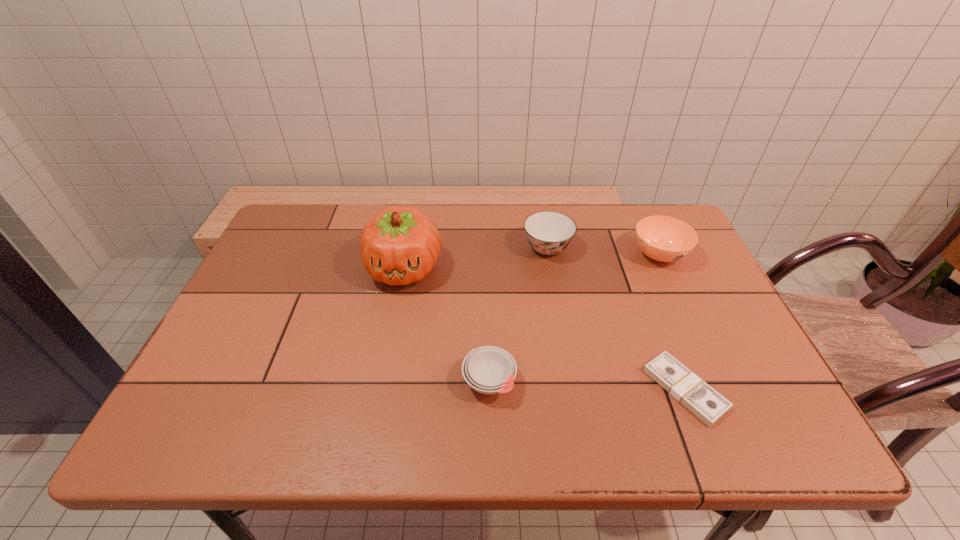
Find the location of a particular element. The height and width of the screenshot is (540, 960). vacant space at the left edge of the desktop is located at coordinates (311, 258).

I want to click on vacant space at the right edge, so click(x=775, y=399).

Find the location of a particular element. vacant space at the far left corner of the desktop is located at coordinates (294, 218).

In the image, there is a desktop. At what (x,y) coordinates should I click in order to perform the action: click on free region at the near left corner. Please return your answer as a coordinate pair (x, y). This screenshot has height=540, width=960. Looking at the image, I should click on (186, 417).

The height and width of the screenshot is (540, 960). I want to click on free spot between the second shortest object and the rightmost soup bowl, so click(x=574, y=319).

Locate an element on the screen. The image size is (960, 540). free spot between the leftmost object and the nearest soup bowl is located at coordinates (446, 325).

At what (x,y) coordinates should I click in order to perform the action: click on free space between the rightmost soup bowl and the shortest soup bowl. Please return your answer as a coordinate pair (x, y). Looking at the image, I should click on (574, 319).

This screenshot has width=960, height=540. In order to click on free space that is in between the dollar and the rightmost soup bowl in this screenshot , I will do `click(672, 322)`.

Identify the location of free spot between the rightmost soup bowl and the leftmost object. This screenshot has height=540, width=960. (532, 261).

Find the location of a particular element. The image size is (960, 540). vacant space that is in between the rightmost soup bowl and the tallest object is located at coordinates (532, 261).